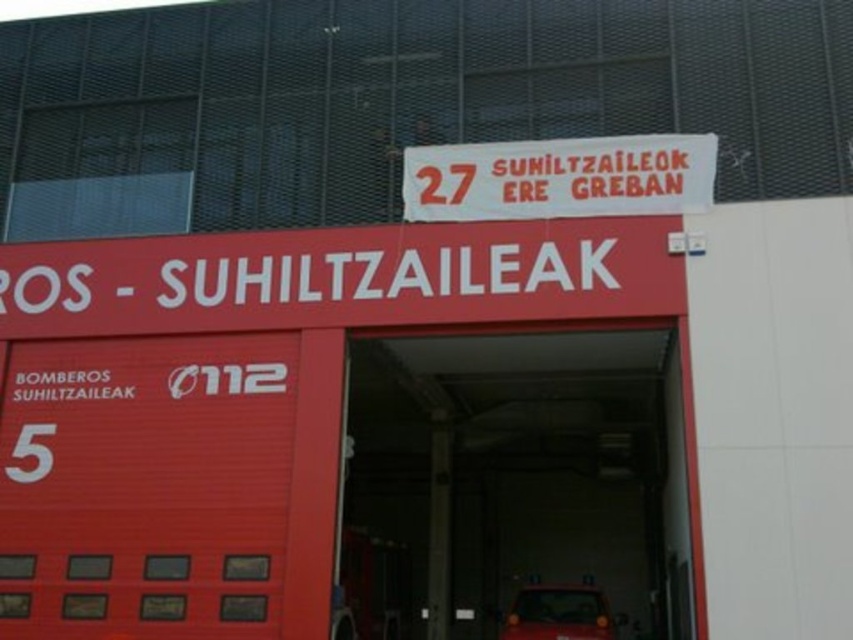
Question: Does red matte garage door at center appear on the right side of metallic red car at center?

Choices:
 (A) no
 (B) yes

Answer: (A)

Question: Which of the following is the farthest from the observer?

Choices:
 (A) white paper sign at center
 (B) red matte garage door at center

Answer: (A)

Question: Is white paper sign at center smaller than metallic red car at center?

Choices:
 (A) no
 (B) yes

Answer: (A)

Question: Is white paper sign at center positioned in front of metallic red car at center?

Choices:
 (A) no
 (B) yes

Answer: (B)

Question: Which of the following is the closest to the observer?

Choices:
 (A) white paper sign at center
 (B) red matte garage door at center

Answer: (B)

Question: Considering the real-world distances, which object is closest to the metallic red car at center?

Choices:
 (A) red matte garage door at center
 (B) white paper sign at center

Answer: (A)